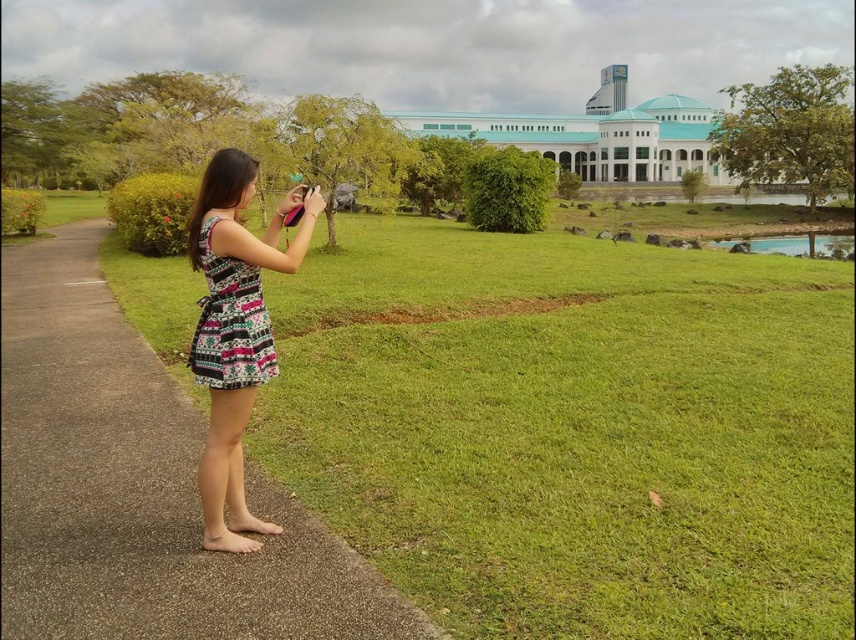
Question: Among these objects, which one is nearest to the camera?

Choices:
 (A) pavement at left
 (B) printed fabric dress at center
 (C) patterned fabric dress at center

Answer: (A)

Question: Is pavement at left above patterned fabric dress at center?

Choices:
 (A) yes
 (B) no

Answer: (B)

Question: Which point is farther to the camera?

Choices:
 (A) patterned fabric dress at center
 (B) printed fabric dress at center
 (C) pavement at left

Answer: (B)

Question: Which object is farther from the camera taking this photo?

Choices:
 (A) printed fabric dress at center
 (B) pavement at left

Answer: (A)

Question: Does pavement at left appear on the right side of printed fabric dress at center?

Choices:
 (A) no
 (B) yes

Answer: (A)

Question: Is pavement at left positioned before printed fabric dress at center?

Choices:
 (A) yes
 (B) no

Answer: (A)